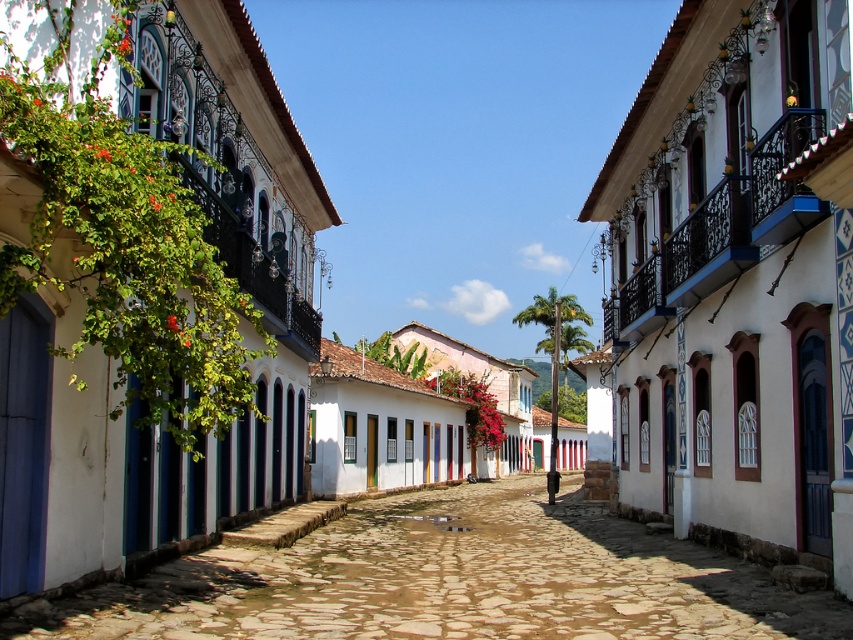
Is white painted wall at center shorter than white painted wall at left?

No, white painted wall at center is not shorter than white painted wall at left.

Can you confirm if white painted wall at center is thinner than white painted wall at left?

Yes, white painted wall at center is thinner than white painted wall at left.

The height and width of the screenshot is (640, 853). What are the coordinates of `white painted wall at center` in the screenshot? It's located at (737, 280).

Find the location of a particular element. white painted wall at center is located at coordinates (737, 280).